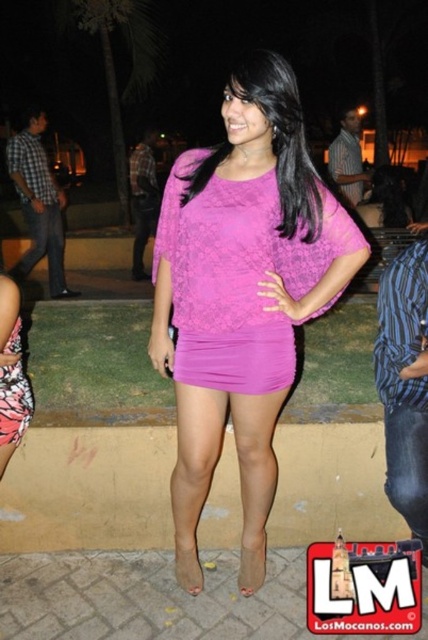
You are a photographer at the event and want to capture both the matte pink blouse at center and the printed fabric dress at lower left in the same frame. Which object should you focus on first to ensure both are in the frame?

The matte pink blouse at center is not as tall as the printed fabric dress at lower left, so you should focus on the printed fabric dress at lower left first to ensure both are in the frame.